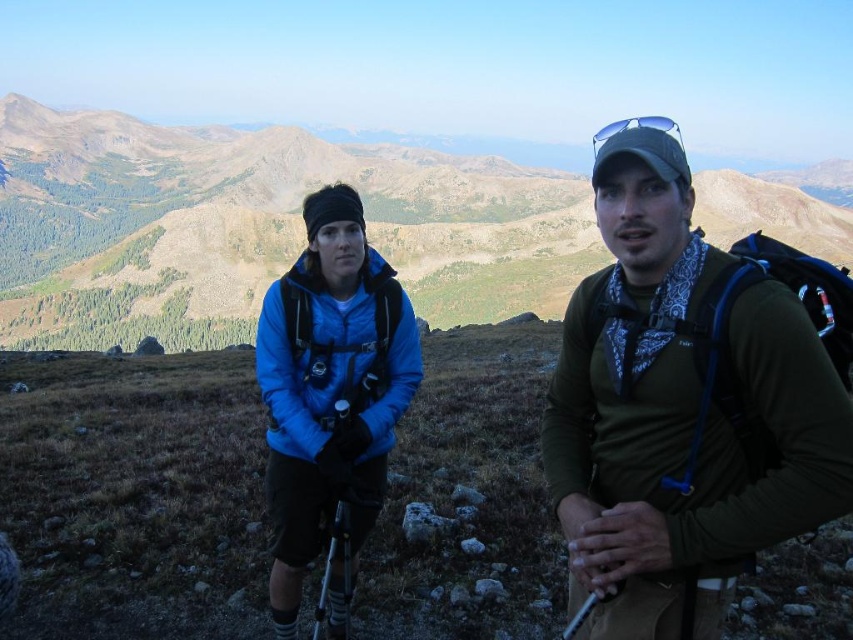
What is the 2D coordinate of the smooth brown mountain at center?

The smooth brown mountain at center is located at the 2D coordinate point of (254, 227).

You are a hiker planning to climb the smooth brown mountain at center while wearing the matte blue jacket at center. The weather forecast predicts strong winds. Considering the distance between the mountain and your jacket, is there any concern about the jacket flying off during the climb?

The smooth brown mountain at center and matte blue jacket at center are 267.13 meters apart from each other. The distance between them does not directly affect the likelihood of the jacket flying off due to wind. The jacket staying on depends on how securely it is fastened, not the distance to the mountain.